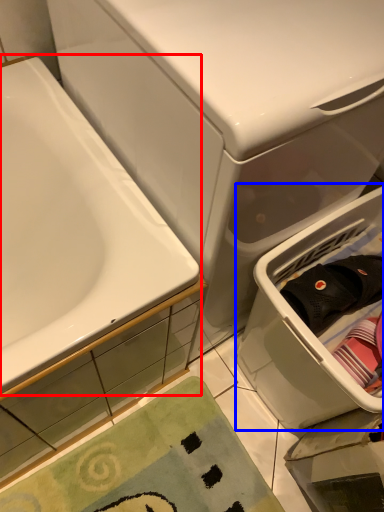
Question: Among these objects, which one is farthest to the camera, bathtub (highlighted by a red box) or laundry basket (highlighted by a blue box)?

Choices:
 (A) bathtub
 (B) laundry basket

Answer: (B)